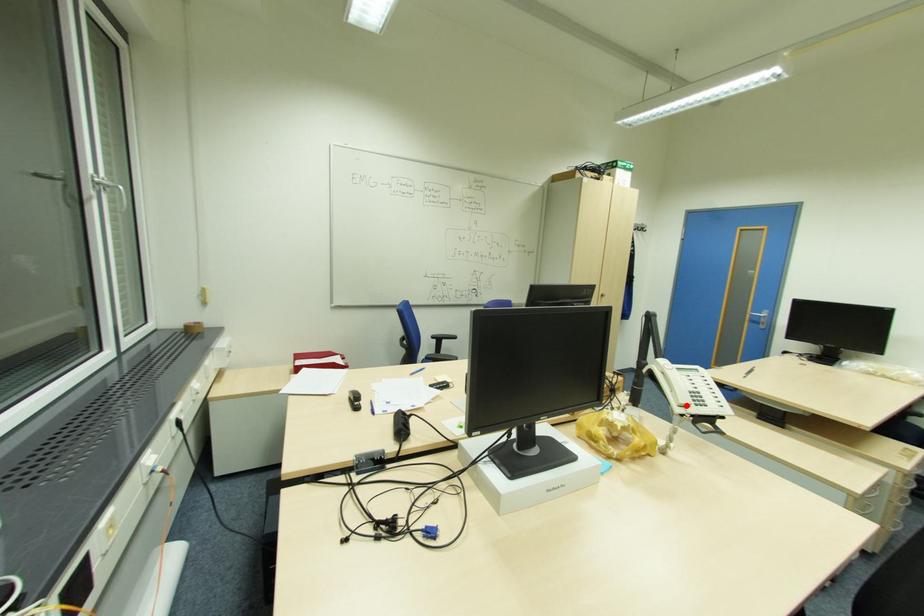
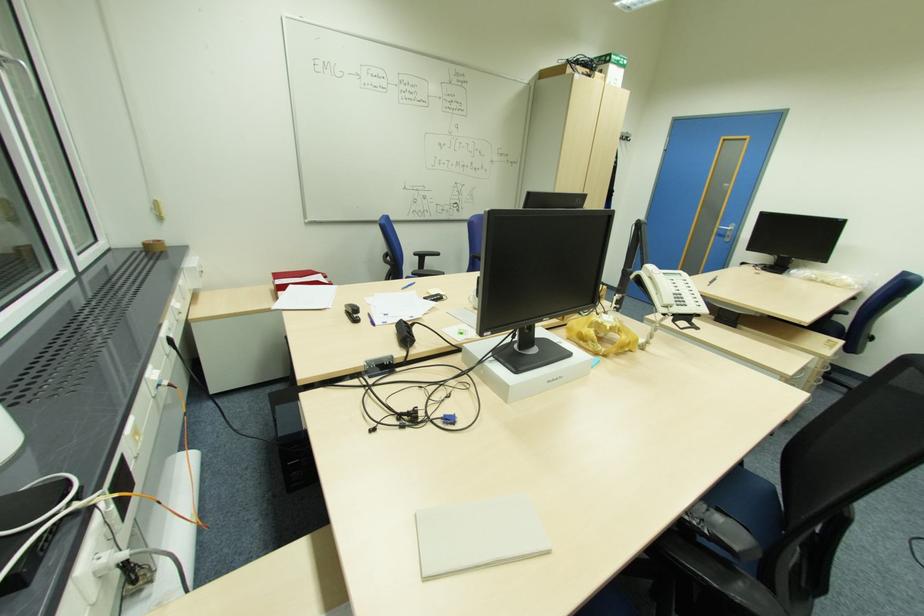
Question: I am providing you with two images of the same scene from different viewpoints. A red point is shown in image1. For the corresponding object point in image2, is it positioned nearer or farther from the camera?

Choices:
 (A) Nearer
 (B) Farther

Answer: (A)